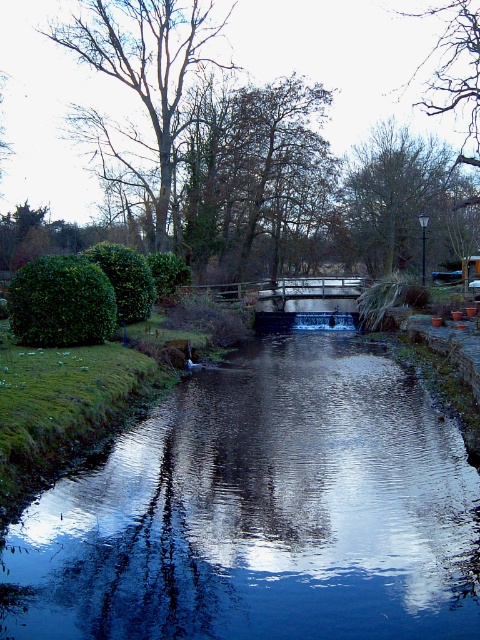
Question: Is smooth dark blue water at center wider than smooth bark tree at upper left?

Choices:
 (A) yes
 (B) no

Answer: (B)

Question: Which object is the farthest from the smooth dark blue water at center?

Choices:
 (A) brown textured tree at upper center
 (B) smooth bark tree at upper left
 (C) green leafy tree at center

Answer: (A)

Question: Among these points, which one is farthest from the camera?

Choices:
 (A) (184, 161)
 (B) (381, 172)

Answer: (B)

Question: Is smooth dark blue water at center wider than brown textured tree at upper center?

Choices:
 (A) yes
 (B) no

Answer: (B)

Question: Estimate the real-world distances between objects in this image. Which object is closer to the smooth bark tree at upper left?

Choices:
 (A) brown textured tree at upper center
 (B) green leafy tree at center
 (C) smooth dark blue water at center

Answer: (B)

Question: Does smooth bark tree at upper left come in front of brown textured tree at upper center?

Choices:
 (A) yes
 (B) no

Answer: (A)